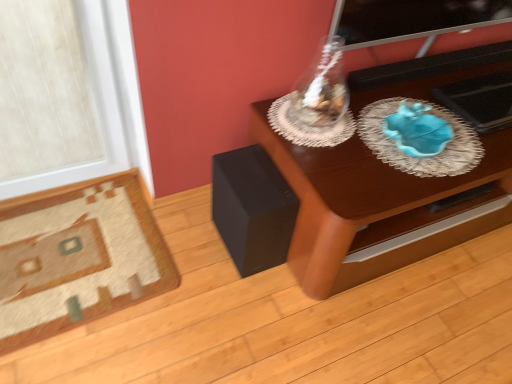
You are a GUI agent. You are given a task and a screenshot of the screen. Output one action in this format:
    pyautogui.click(x=<x>, y=<y>)
    Task: Click on the blue glass plate at right
    
    Given the screenshot: What is the action you would take?
    pyautogui.click(x=419, y=137)

The height and width of the screenshot is (384, 512). Find the location of `black matte speaker at lower left`. black matte speaker at lower left is located at coordinates (252, 208).

Find the location of `blue glass plate at right`. blue glass plate at right is located at coordinates (419, 137).

In the image, is transparent glass vase at upper center positioned in front of or behind black matte speaker at lower left?

Clearly, transparent glass vase at upper center is in front of black matte speaker at lower left.

Can you confirm if transparent glass vase at upper center is wider than black matte speaker at lower left?

No.

From a real-world perspective, is transparent glass vase at upper center positioned over black matte speaker at lower left based on gravity?

Yes, from a real-world perspective, transparent glass vase at upper center is on top of black matte speaker at lower left.

Is wooden table at center at the right side of transparent glass vase at upper center?

Yes, wooden table at center is to the right of transparent glass vase at upper center.

Which point is more forward, [358,87] or [320,102]?

The point [320,102] is more forward.

From the picture: Which is correct: wooden table at center is inside transparent glass vase at upper center, or outside of it?

wooden table at center is not inside transparent glass vase at upper center, it's outside.

Considering the relative sizes of wooden table at center and transparent glass vase at upper center in the image provided, is wooden table at center shorter than transparent glass vase at upper center?

No.

Is wooden table at center turned away from blue glass plate at right?

wooden table at center does not have its back to blue glass plate at right.

From the image's perspective, who appears lower, wooden table at center or blue glass plate at right?

From the image's view, wooden table at center is below.

Where is `glass plate that is above the wooden table at center (from a real-world perspective)`? The image size is (512, 384). glass plate that is above the wooden table at center (from a real-world perspective) is located at coordinates (419, 137).

Is transparent glass vase at upper center positioned with its back to blue glass plate at right?

No, transparent glass vase at upper center is not facing away from blue glass plate at right.

From a real-world perspective, is transparent glass vase at upper center physically above blue glass plate at right?

Yes, from a real-world perspective, transparent glass vase at upper center is above blue glass plate at right.

Does transparent glass vase at upper center touch blue glass plate at right?

transparent glass vase at upper center and blue glass plate at right are not in contact.

Considering the sizes of blue glass plate at right and carpeted rug at lower left in the image, is blue glass plate at right taller or shorter than carpeted rug at lower left?

Clearly, blue glass plate at right is taller compared to carpeted rug at lower left.

Which point is more distant from viewer, (407, 148) or (37, 259)?

Positioned behind is point (37, 259).

Locate an element on the screen. This screenshot has width=512, height=384. furniture that is below the blue glass plate at right (from the image's perspective) is located at coordinates 78,257.

Between transparent glass vase at upper center and carpeted rug at lower left, which one has larger size?

With larger size is carpeted rug at lower left.

Does point (329, 80) come in front of point (35, 306)?

No.

In the scene shown: From the image's perspective, between transparent glass vase at upper center and carpeted rug at lower left, who is located below?

carpeted rug at lower left.

From the image's perspective, is carpeted rug at lower left above or below wooden table at center?

Answer: carpeted rug at lower left is below wooden table at center.

Considering the points (33, 239) and (367, 199), which point is in front, point (33, 239) or point (367, 199)?

Point (367, 199)

Can you confirm if carpeted rug at lower left is thinner than wooden table at center?

Correct, the width of carpeted rug at lower left is less than that of wooden table at center.

Between carpeted rug at lower left and wooden table at center, which one has larger size?

wooden table at center is bigger.

I want to click on speaker behind the transparent glass vase at upper center, so click(252, 208).

I want to click on glass vase lying above the wooden table at center (from the image's perspective), so click(322, 86).

Looking at the image, which one is located closer to carpeted rug at lower left, wooden table at center or black matte speaker at lower left?

black matte speaker at lower left lies closer to carpeted rug at lower left than the other object.

From the image, which object appears to be farther from carpeted rug at lower left, blue glass plate at right or transparent glass vase at upper center?

The object further to carpeted rug at lower left is blue glass plate at right.

Which object lies nearer to the anchor point blue glass plate at right, carpeted rug at lower left or wooden table at center?

Among the two, wooden table at center is located nearer to blue glass plate at right.

Based on their spatial positions, is wooden table at center or transparent glass vase at upper center further from blue glass plate at right?

transparent glass vase at upper center lies further to blue glass plate at right than the other object.

From the image, which object appears to be farther from wooden table at center, transparent glass vase at upper center or black matte speaker at lower left?

transparent glass vase at upper center is further to wooden table at center.

When comparing their distances from black matte speaker at lower left, does carpeted rug at lower left or wooden table at center seem further?

carpeted rug at lower left is further to black matte speaker at lower left.

Looking at the image, which one is located closer to carpeted rug at lower left, transparent glass vase at upper center or wooden table at center?

wooden table at center lies closer to carpeted rug at lower left than the other object.

From the image, which object appears to be nearer to blue glass plate at right, black matte speaker at lower left or wooden table at center?

wooden table at center.

Where is `speaker between carpeted rug at lower left and wooden table at center`? speaker between carpeted rug at lower left and wooden table at center is located at coordinates (252, 208).

This screenshot has height=384, width=512. What are the coordinates of `speaker located between carpeted rug at lower left and transparent glass vase at upper center in the left-right direction` in the screenshot? It's located at (252, 208).

Where is `speaker situated between carpeted rug at lower left and blue glass plate at right from left to right`? speaker situated between carpeted rug at lower left and blue glass plate at right from left to right is located at coordinates click(x=252, y=208).

The width and height of the screenshot is (512, 384). Find the location of `glass plate situated between transparent glass vase at upper center and wooden table at center from left to right`. glass plate situated between transparent glass vase at upper center and wooden table at center from left to right is located at coordinates click(419, 137).